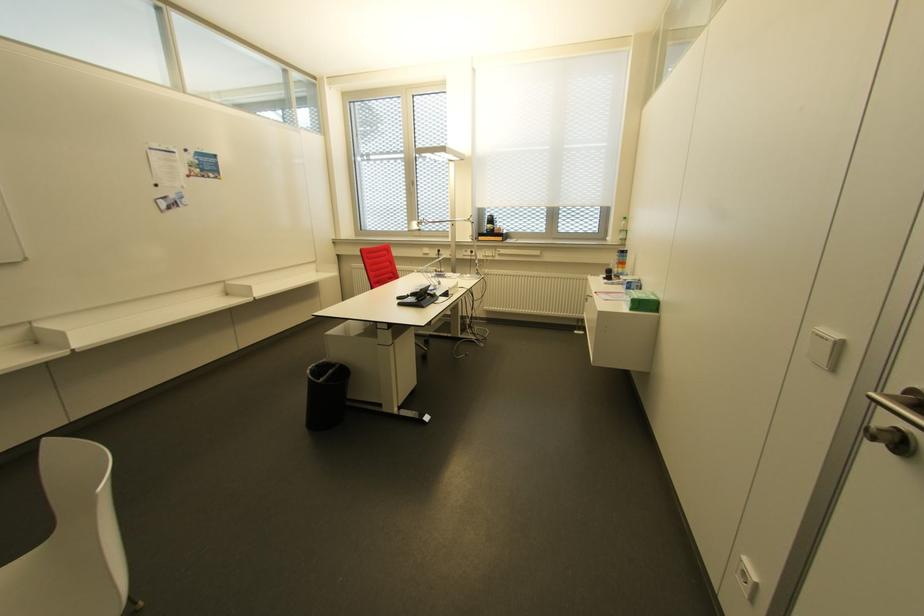
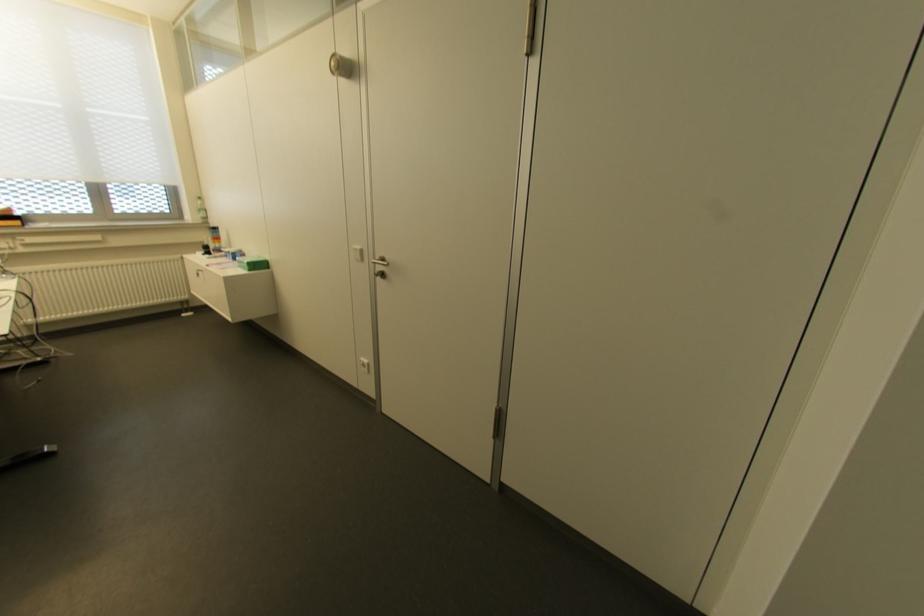
The point at [833,334] is marked in the first image. Where is the corresponding point in the second image?

(358, 246)